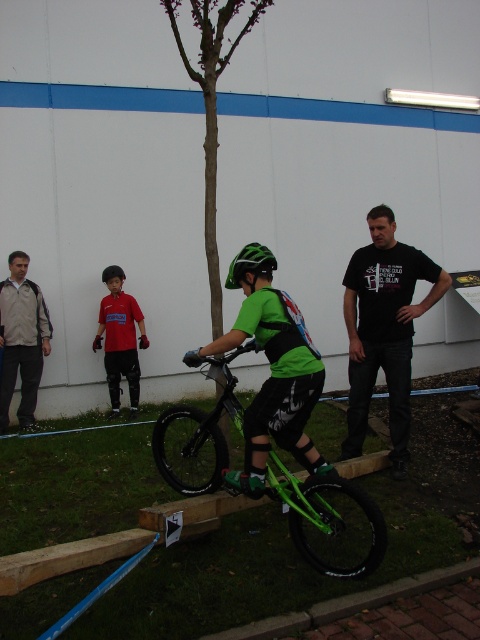
Question: Can you confirm if khaki fabric jacket at left is positioned to the right of red shirt at center?

Choices:
 (A) no
 (B) yes

Answer: (A)

Question: Which of the following is the farthest from the observer?

Choices:
 (A) click(x=216, y=454)
 (B) click(x=43, y=308)

Answer: (B)

Question: Does black t-shirt at center appear on the left side of khaki fabric jacket at left?

Choices:
 (A) yes
 (B) no

Answer: (B)

Question: Which object appears farthest from the camera in this image?

Choices:
 (A) green matte bicycle helmet at center
 (B) green matte bicycle at center

Answer: (A)

Question: Can you confirm if black t-shirt at center is smaller than red shirt at center?

Choices:
 (A) yes
 (B) no

Answer: (B)

Question: Which is farther from the red shirt at center?

Choices:
 (A) khaki fabric jacket at left
 (B) green matte bicycle at center

Answer: (B)